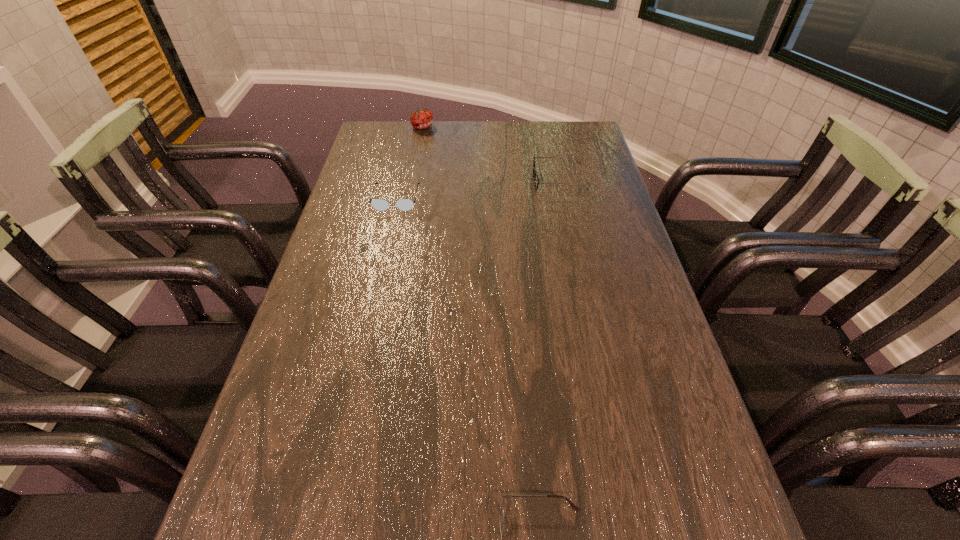
The image size is (960, 540). Find the location of `tomato`. tomato is located at coordinates (422, 118).

At what (x,y) coordinates should I click in order to perform the action: click on the tallest object. Please return your answer as a coordinate pair (x, y). Looking at the image, I should click on (422, 118).

Where is `the rightmost spectacles`? This screenshot has width=960, height=540. the rightmost spectacles is located at coordinates (536, 181).

Image resolution: width=960 pixels, height=540 pixels. Identify the location of the second shortest spectacles. (378, 204).

Find the location of a particular element. the second shortest object is located at coordinates (378, 204).

This screenshot has height=540, width=960. I want to click on vacant space located on the front of the tallest object, so click(x=415, y=169).

This screenshot has width=960, height=540. Find the location of `vacant region located 0.140m through the lenses of the rightmost spectacles`. vacant region located 0.140m through the lenses of the rightmost spectacles is located at coordinates (489, 181).

Locate an element on the screen. The image size is (960, 540). free region located through the lenses of the rightmost spectacles is located at coordinates (473, 181).

Where is `free space located 0.340m through the lenses of the rightmost spectacles`? The height and width of the screenshot is (540, 960). free space located 0.340m through the lenses of the rightmost spectacles is located at coordinates (425, 181).

Identify the location of vacant area situated on the lenses of the second shortest spectacles. The image size is (960, 540). (374, 296).